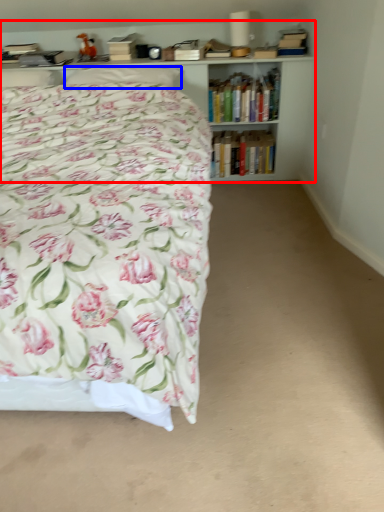
Question: Which of the following is the farthest to the observer, bookcase (highlighted by a red box) or pillow (highlighted by a blue box)?

Choices:
 (A) bookcase
 (B) pillow

Answer: (A)